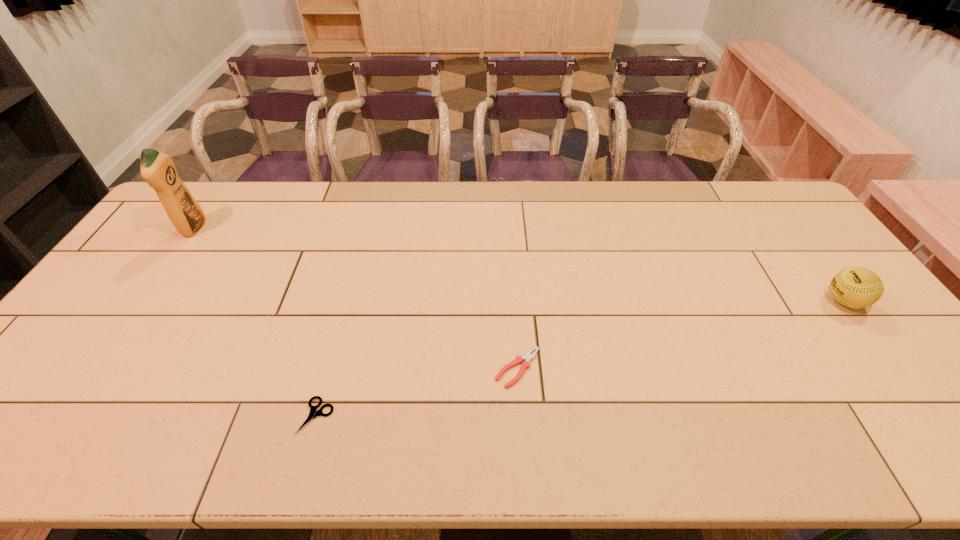
Find the location of `free space at the near edge of the desktop`. free space at the near edge of the desktop is located at coordinates (337, 442).

Find the location of a particular element. This screenshot has width=960, height=540. free space at the right edge is located at coordinates (798, 290).

Image resolution: width=960 pixels, height=540 pixels. What are the coordinates of `vacant point at the near left corner` in the screenshot? It's located at (55, 446).

Where is `free space at the far right corner of the desktop`? free space at the far right corner of the desktop is located at coordinates (769, 207).

The height and width of the screenshot is (540, 960). Identify the location of empty space between the third object from left to right and the tallest object. (356, 298).

Where is `vacant space in between the shears and the pliers`? This screenshot has height=540, width=960. vacant space in between the shears and the pliers is located at coordinates (418, 392).

The image size is (960, 540). I want to click on free space between the second tallest object and the tallest object, so coord(519,265).

The height and width of the screenshot is (540, 960). Identify the location of vacant space that is in between the pliers and the softball. (681, 335).

The height and width of the screenshot is (540, 960). I want to click on unoccupied position between the detergent and the pliers, so click(x=356, y=298).

In order to click on empty space that is in between the second tallest object and the tallest object in this screenshot , I will do `click(519, 265)`.